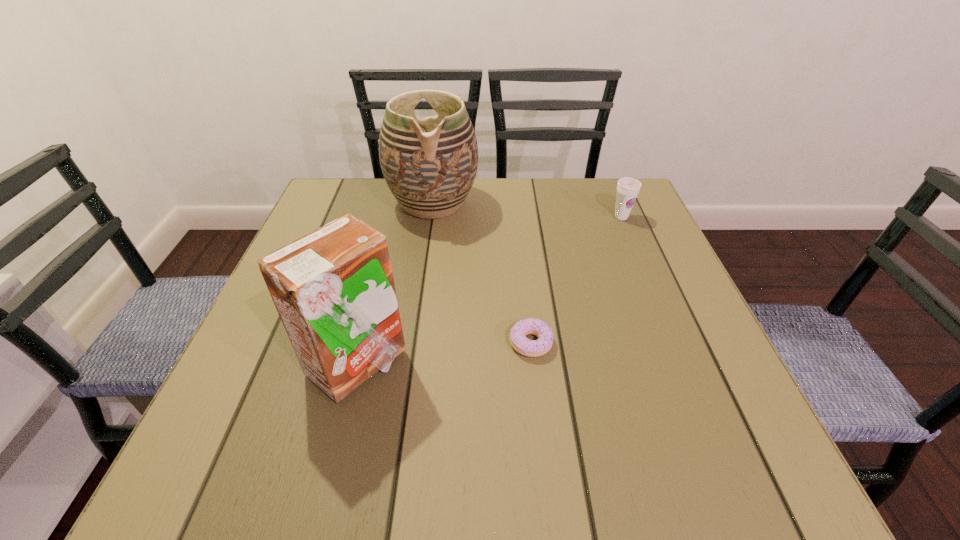
Identify the location of pottery. The height and width of the screenshot is (540, 960). (429, 164).

You are a GUI agent. You are given a task and a screenshot of the screen. Output one action in this format:
    pyautogui.click(x=<x>, y=<y>)
    Task: Click on the carton
    The height and width of the screenshot is (540, 960).
    Given the screenshot: What is the action you would take?
    pyautogui.click(x=333, y=288)

Identify the location of the second shortest object. The width and height of the screenshot is (960, 540). (628, 188).

Locate an element on the screen. The image size is (960, 540). cup is located at coordinates (628, 188).

Image resolution: width=960 pixels, height=540 pixels. I want to click on the shortest object, so click(x=531, y=326).

Find the location of `the second object from right to left`. the second object from right to left is located at coordinates (531, 326).

Where is `free location located on the left of the pottery`? free location located on the left of the pottery is located at coordinates (369, 203).

What are the coordinates of `free space located on the straw side of the carton` in the screenshot? It's located at (599, 365).

Image resolution: width=960 pixels, height=540 pixels. I want to click on vacant area situated 0.130m on the back of the rightmost object, so click(x=608, y=185).

Find the location of a particular element. This screenshot has width=960, height=540. vacant region located 0.360m on the left of the doughnut is located at coordinates (312, 343).